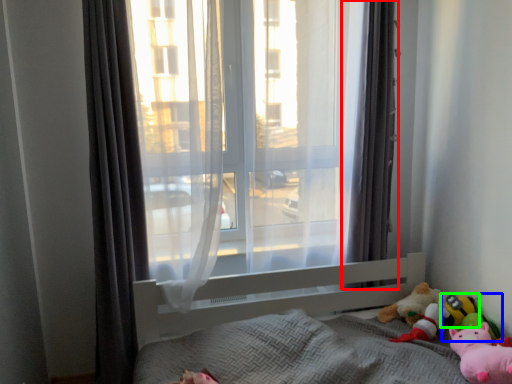
Question: Based on their relative distances, which object is farther from curtain (highlighted by a red box)? Choose from toy (highlighted by a blue box) and toy (highlighted by a green box).

Choices:
 (A) toy
 (B) toy

Answer: (B)